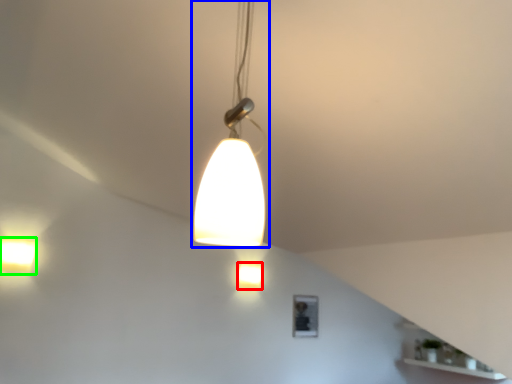
Question: Estimate the real-world distances between objects in this image. Which object is farther from lamp (highlighted by a red box), lamp (highlighted by a blue box) or lamp (highlighted by a green box)?

Choices:
 (A) lamp
 (B) lamp

Answer: (A)